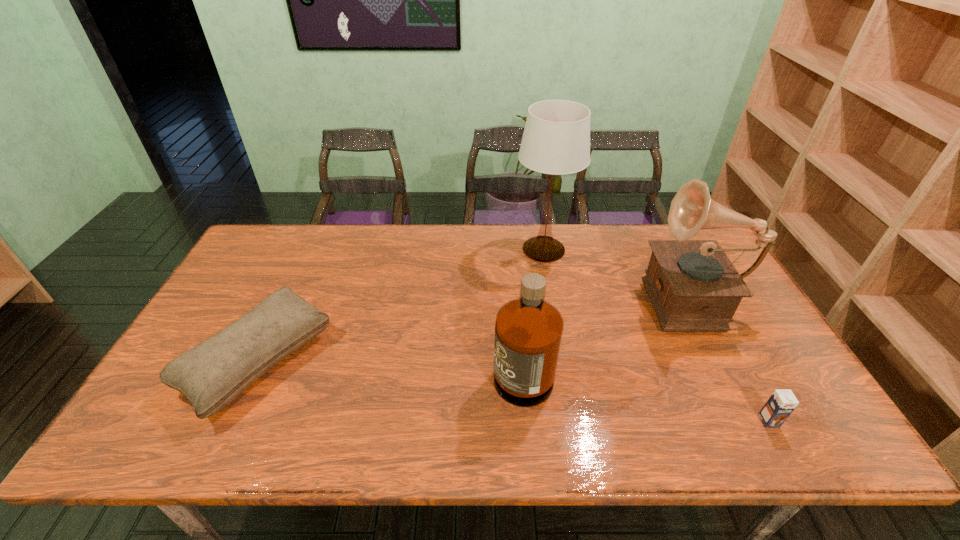
Locate an element on the screen. The image size is (960, 540). vacant space that is in between the table lamp and the cushion is located at coordinates (401, 305).

The height and width of the screenshot is (540, 960). I want to click on vacant area between the table lamp and the cushion, so click(401, 305).

This screenshot has height=540, width=960. What are the coordinates of `vacant space that's between the liquor and the shortest object` in the screenshot? It's located at (645, 392).

Image resolution: width=960 pixels, height=540 pixels. I want to click on free area in between the chocolate milk and the third tallest object, so click(645, 392).

The height and width of the screenshot is (540, 960). Find the location of `free space that is in between the record player and the liquor`. free space that is in between the record player and the liquor is located at coordinates (605, 329).

At what (x,y) coordinates should I click in order to perform the action: click on free space between the record player and the liquor. Please return your answer as a coordinate pair (x, y). The height and width of the screenshot is (540, 960). Looking at the image, I should click on (605, 329).

What are the coordinates of `free spot between the fourth tallest object and the table lamp` in the screenshot? It's located at (401, 305).

Identify the location of free space between the table lamp and the record player. This screenshot has height=540, width=960. (615, 273).

What are the coordinates of `free space that is in between the fourth tallest object and the third tallest object` in the screenshot? It's located at (391, 361).

Identify which object is the second nearest to the table lamp. Please provide its 2D coordinates. Your answer should be formatted as a tuple, i.e. [(x, y)], where the tuple contains the x and y coordinates of a point satisfying the conditions above.

[(528, 330)]